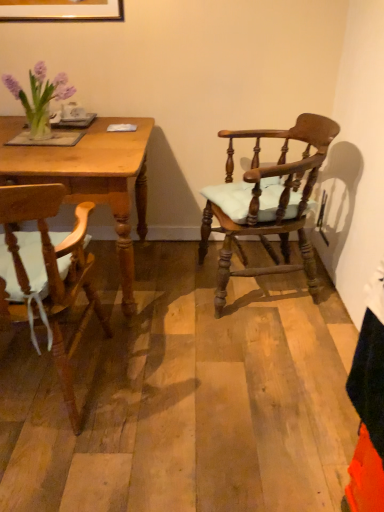
Question: Would you say wooden table at left is outside wooden chair with cushion at left, which appears as the 1th chair when viewed from the left?

Choices:
 (A) yes
 (B) no

Answer: (A)

Question: Is wooden table at left placed right next to wooden chair with cushion at left, which is counted as the second chair, starting from the right?

Choices:
 (A) no
 (B) yes

Answer: (A)

Question: Is wooden chair with cushion at left, which is counted as the second chair, starting from the right, located within wooden table at left?

Choices:
 (A) yes
 (B) no

Answer: (B)

Question: Can you confirm if wooden table at left is thinner than wooden chair with cushion at left, which is counted as the second chair, starting from the right?

Choices:
 (A) yes
 (B) no

Answer: (B)

Question: Considering the relative sizes of wooden table at left and wooden chair with cushion at left, which appears as the 1th chair when viewed from the left, in the image provided, is wooden table at left wider than wooden chair with cushion at left, which appears as the 1th chair when viewed from the left,?

Choices:
 (A) no
 (B) yes

Answer: (B)

Question: Is wooden chair with cushion at left, which appears as the 1th chair when viewed from the left, at the back of wooden table at left?

Choices:
 (A) yes
 (B) no

Answer: (B)

Question: Does wooden table at left come in front of white ceramic mug at upper left?

Choices:
 (A) no
 (B) yes

Answer: (B)

Question: Is wooden table at left turned away from white ceramic mug at upper left?

Choices:
 (A) yes
 (B) no

Answer: (B)

Question: Can you confirm if wooden table at left is smaller than white ceramic mug at upper left?

Choices:
 (A) yes
 (B) no

Answer: (B)

Question: Considering the relative sizes of wooden table at left and white ceramic mug at upper left in the image provided, is wooden table at left thinner than white ceramic mug at upper left?

Choices:
 (A) no
 (B) yes

Answer: (A)

Question: Is there a large distance between wooden table at left and white ceramic mug at upper left?

Choices:
 (A) no
 (B) yes

Answer: (A)

Question: From a real-world perspective, is wooden table at left on top of white ceramic mug at upper left?

Choices:
 (A) no
 (B) yes

Answer: (A)

Question: Considering the relative sizes of wooden chair with cushion at left, which appears as the 1th chair when viewed from the left, and wooden table at left in the image provided, is wooden chair with cushion at left, which appears as the 1th chair when viewed from the left, taller than wooden table at left?

Choices:
 (A) no
 (B) yes

Answer: (B)